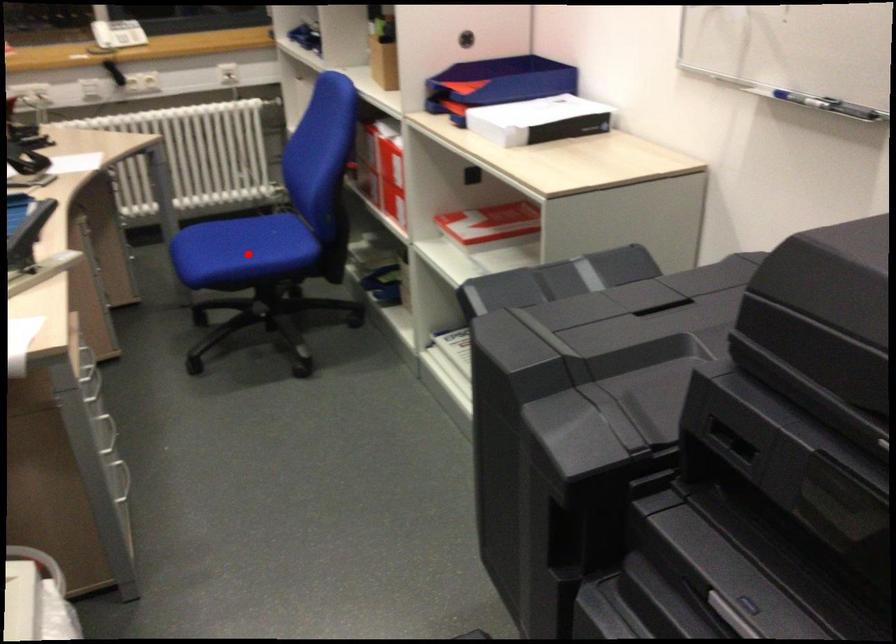
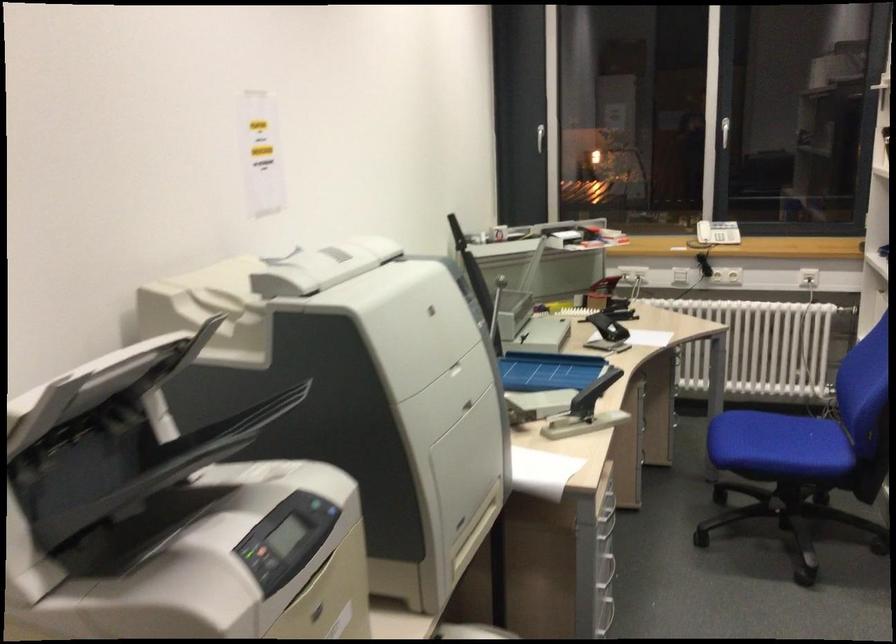
Find the pixel in the second image that matches the highlighted location in the first image.

(778, 446)